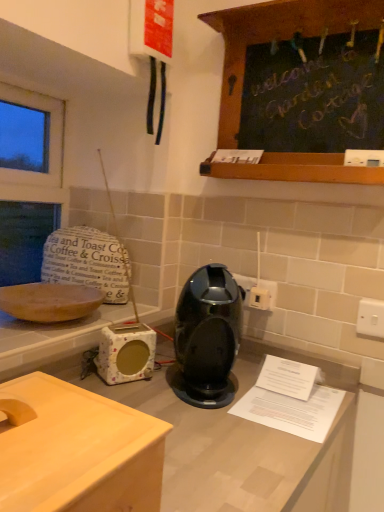
Question: Is matte wooden bowl at left turned away from white plastic electric outlet at center-right, which ranks as the third electric outlet in front-to-back order?

Choices:
 (A) no
 (B) yes

Answer: (A)

Question: From a real-world perspective, is matte wooden bowl at left below white plastic electric outlet at center-right, the third electric outlet when ordered from right to left?

Choices:
 (A) yes
 (B) no

Answer: (A)

Question: Does matte wooden bowl at left have a smaller size compared to white plastic electric outlet at center-right, which is the 1th electric outlet from back to front?

Choices:
 (A) yes
 (B) no

Answer: (B)

Question: Does matte wooden bowl at left appear on the right side of white plastic electric outlet at center-right, which is the 1th electric outlet from back to front?

Choices:
 (A) no
 (B) yes

Answer: (A)

Question: Is matte wooden bowl at left positioned behind white plastic electric outlet at center-right, which is the 1th electric outlet from back to front?

Choices:
 (A) no
 (B) yes

Answer: (A)

Question: Is glossy plastic coffee machine at center inside the boundaries of matte wooden bowl at left, or outside?

Choices:
 (A) outside
 (B) inside

Answer: (A)

Question: In terms of width, does glossy plastic coffee machine at center look wider or thinner when compared to matte wooden bowl at left?

Choices:
 (A) wide
 (B) thin

Answer: (B)

Question: In the image, is glossy plastic coffee machine at center positioned in front of or behind matte wooden bowl at left?

Choices:
 (A) behind
 (B) front

Answer: (B)

Question: From their relative heights in the image, would you say glossy plastic coffee machine at center is taller or shorter than matte wooden bowl at left?

Choices:
 (A) short
 (B) tall

Answer: (B)

Question: Is white plastic switch at right, the first electric outlet when ordered from front to back, in front of or behind black wood chalkboard at upper right in the image?

Choices:
 (A) behind
 (B) front

Answer: (A)

Question: Is white plastic switch at right, the first electric outlet when ordered from front to back, to the left or to the right of black wood chalkboard at upper right in the image?

Choices:
 (A) right
 (B) left

Answer: (A)

Question: Is white plastic switch at right, the first electric outlet when ordered from front to back, taller or shorter than black wood chalkboard at upper right?

Choices:
 (A) tall
 (B) short

Answer: (B)

Question: From the image's perspective, relative to black wood chalkboard at upper right, is white plastic switch at right, arranged as the 3th electric outlet when viewed from the back, above or below?

Choices:
 (A) above
 (B) below

Answer: (B)

Question: Considering the positions of white plastic electric outlet at center-right, positioned as the second electric outlet in left-to-right order, and floral-patterned ceramic toaster at lower left in the image, is white plastic electric outlet at center-right, positioned as the second electric outlet in left-to-right order, taller or shorter than floral-patterned ceramic toaster at lower left?

Choices:
 (A) tall
 (B) short

Answer: (B)

Question: In terms of width, does white plastic electric outlet at center-right, which appears as the second electric outlet when viewed from the back, look wider or thinner when compared to floral-patterned ceramic toaster at lower left?

Choices:
 (A) wide
 (B) thin

Answer: (B)